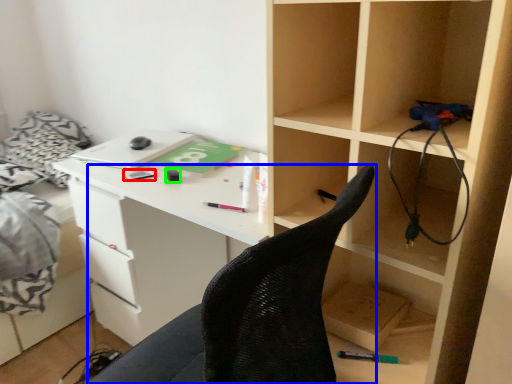
Question: Which object is positioned closest to stationery (highlighted by a red box)? Select from chair (highlighted by a blue box) and stationery (highlighted by a green box).

Choices:
 (A) chair
 (B) stationery

Answer: (B)